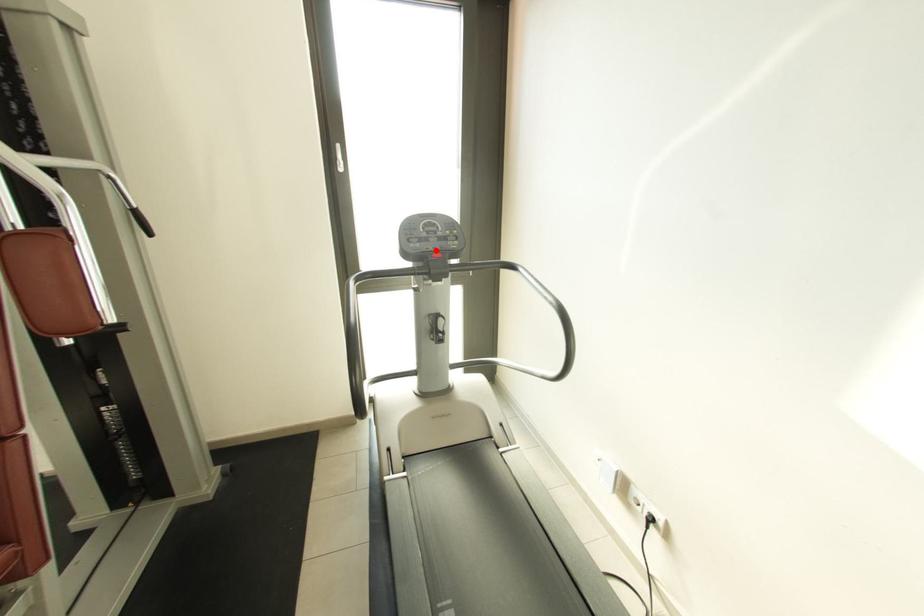
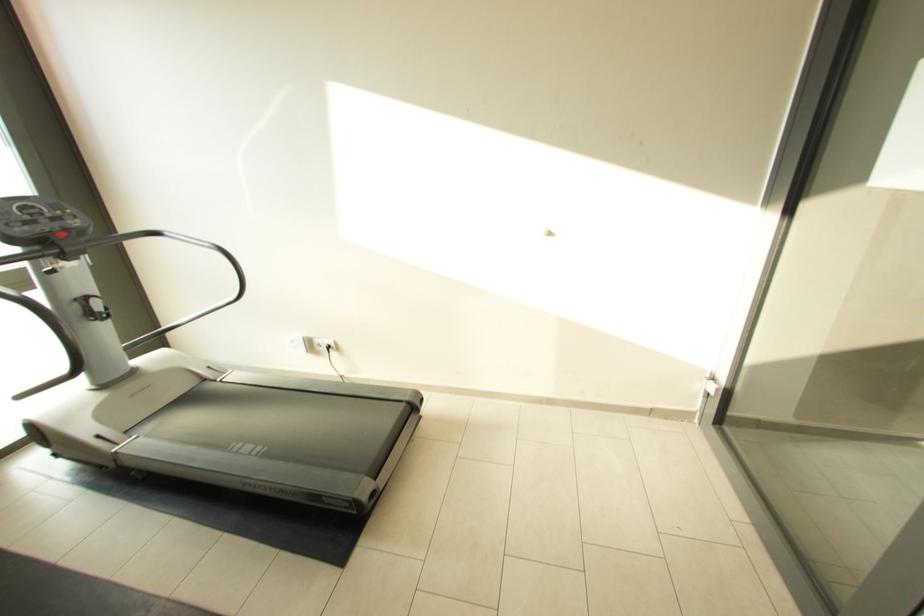
Question: I am providing you with two images of the same scene from different viewpoints. Image1 has a red point marked. In image2, the corresponding 3D location appears at what relative position? Reply with the corresponding letter.

Choices:
 (A) Closer
 (B) Farther

Answer: (B)